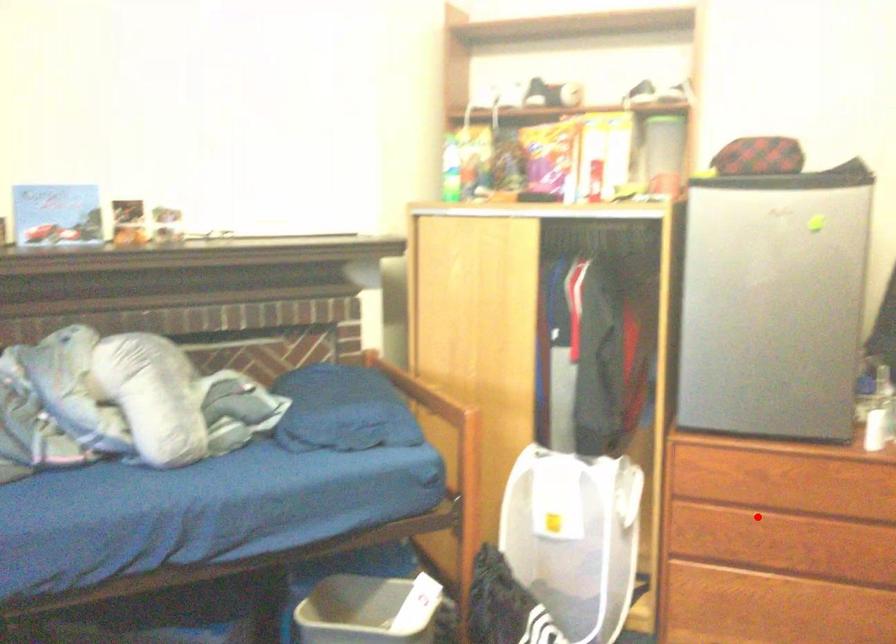
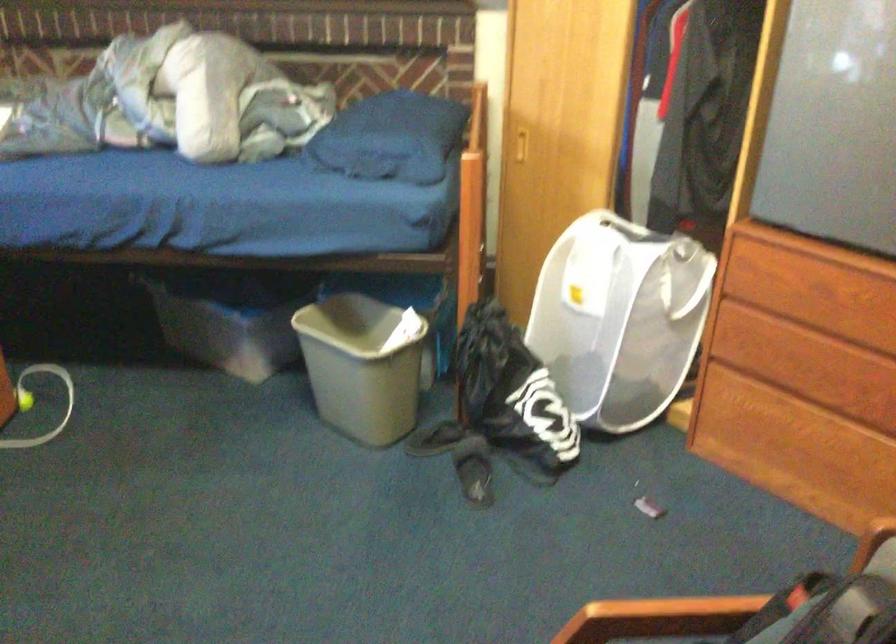
In the second image, find the point that corresponds to the highlighted location in the first image.

(808, 342)